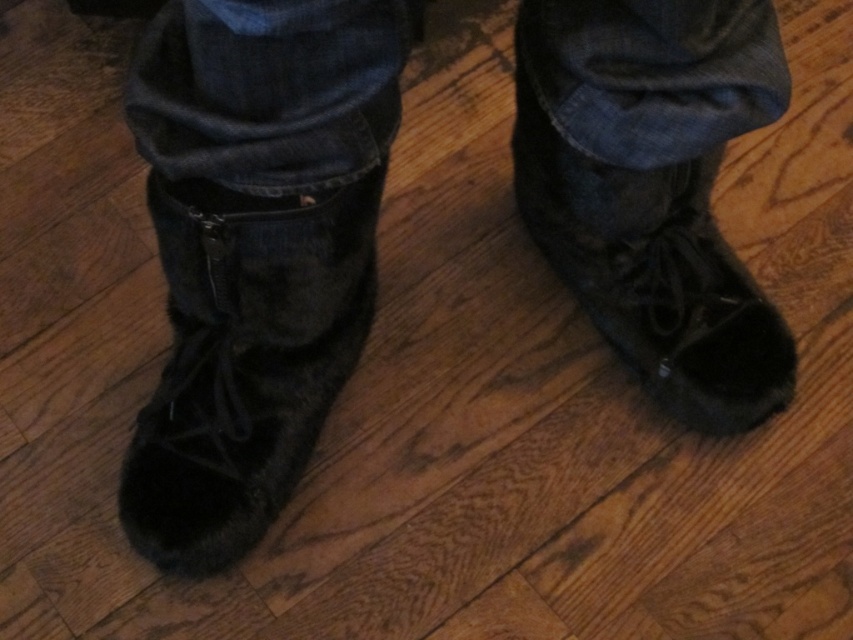
Question: Is denim at center above fuzzy black boot at left?

Choices:
 (A) no
 (B) yes

Answer: (B)

Question: Does fuzzy black boots at center appear on the left side of black suede boot at center?

Choices:
 (A) yes
 (B) no

Answer: (A)

Question: Which object is the farthest from the black suede boot at center?

Choices:
 (A) fuzzy black boot at left
 (B) fuzzy black boots at center

Answer: (A)

Question: Which point appears farthest from the camera in this image?

Choices:
 (A) (701, 60)
 (B) (245, 365)
 (C) (787, 384)
 (D) (270, 470)

Answer: (C)

Question: Can you confirm if denim at center is smaller than black suede boot at center?

Choices:
 (A) no
 (B) yes

Answer: (B)

Question: Which object is positioned farthest from the denim at center?

Choices:
 (A) black suede boot at center
 (B) fuzzy black boot at left

Answer: (B)